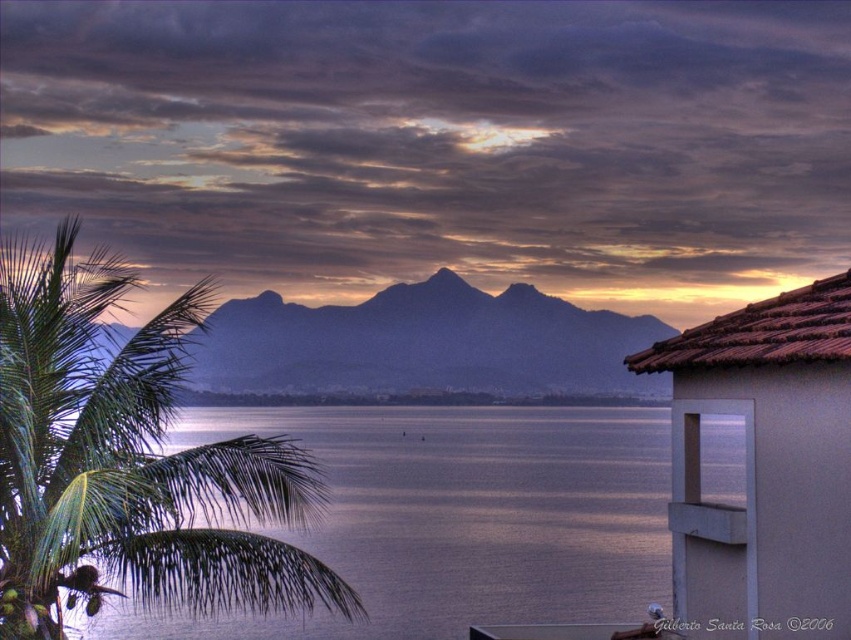
Between point (37, 262) and point (694, 524), which one is positioned behind?

The point (694, 524) is behind.

The width and height of the screenshot is (851, 640). Describe the element at coordinates (129, 461) in the screenshot. I see `green leafy palm tree at left` at that location.

You are a GUI agent. You are given a task and a screenshot of the screen. Output one action in this format:
    pyautogui.click(x=<x>, y=<y>)
    Task: Click on the green leafy palm tree at left
    The width and height of the screenshot is (851, 640).
    Given the screenshot: What is the action you would take?
    pyautogui.click(x=129, y=461)

Which is in front, point (747, 353) or point (737, 515)?

Point (747, 353) is more forward.

Is point (703, 596) less distant than point (707, 513)?

No, (703, 596) is behind (707, 513).

In order to click on brown tile roof at right in this screenshot , I will do `click(768, 460)`.

Who is shorter, smokey gray water at center or metallic gray balcony at lower right?

Standing shorter between the two is metallic gray balcony at lower right.

Consider the image. Who is more distant from viewer, (598,486) or (738,538)?

The point (598,486) is behind.

The width and height of the screenshot is (851, 640). What do you see at coordinates (455, 518) in the screenshot?
I see `smokey gray water at center` at bounding box center [455, 518].

At what (x,y) coordinates should I click in order to perform the action: click on smokey gray water at center. Please return your answer as a coordinate pair (x, y). This screenshot has height=640, width=851. Looking at the image, I should click on (455, 518).